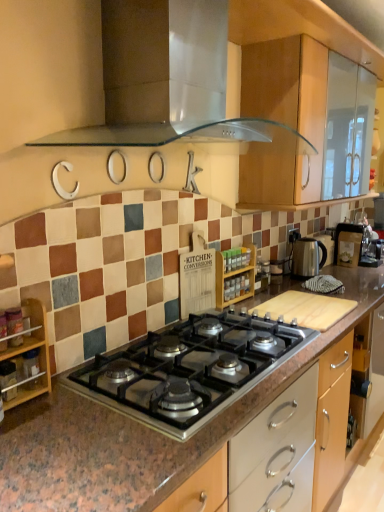
This screenshot has width=384, height=512. What do you see at coordinates (326, 245) in the screenshot?
I see `metallic silver kettle at right, the 1th appliance positioned from the back` at bounding box center [326, 245].

At what (x,y) coordinates should I click in order to perform the action: click on silver metallic kettle at right. Please return your answer as a coordinate pair (x, y). The image size is (384, 512). Looking at the image, I should click on (307, 257).

I want to click on wooden shelf at left, so click(29, 358).

Can you confirm if silver metallic kettle at right is taller than metallic silver coffee maker at right, which is counted as the 1th appliance, starting from the right?

No.

Are silver metallic kettle at right and metallic silver coffee maker at right, acting as the third appliance starting from the left, beside each other?

No, silver metallic kettle at right is not beside metallic silver coffee maker at right, acting as the third appliance starting from the left.

Locate an element on the screen. kitchen appliance below the metallic silver coffee maker at right, marked as the second appliance in a front-to-back arrangement (from the image's perspective) is located at coordinates (307, 257).

Does point (309, 274) come in front of point (360, 254)?

Yes, it is in front of point (360, 254).

Does transparent glass range hood at upper center have a larger size compared to metallic silver coffee maker at right, the 2th appliance when ordered from back to front?

Correct, transparent glass range hood at upper center is larger in size than metallic silver coffee maker at right, the 2th appliance when ordered from back to front.

From a real-world perspective, is transparent glass range hood at upper center beneath metallic silver coffee maker at right, acting as the third appliance starting from the left?

No, from a real-world perspective, transparent glass range hood at upper center is not beneath metallic silver coffee maker at right, acting as the third appliance starting from the left.

Is point (159, 58) closer or farther from the camera than point (349, 244)?

Point (159, 58) is positioned closer to the camera compared to point (349, 244).

From a real-world perspective, which appliance is the 1st one underneath the transparent glass range hood at upper center? Please provide its 2D coordinates.

[(348, 244)]

Between metallic silver coffee maker at right, marked as the second appliance in a front-to-back arrangement, and black stainless steel gas stove at center, which one has larger width?

With larger width is black stainless steel gas stove at center.

Consider the image. Which is correct: metallic silver coffee maker at right, acting as the third appliance starting from the left, is inside black stainless steel gas stove at center, or outside of it?

metallic silver coffee maker at right, acting as the third appliance starting from the left, is not enclosed by black stainless steel gas stove at center.

Can you tell me how much metallic silver coffee maker at right, which is counted as the 1th appliance, starting from the right, and black stainless steel gas stove at center differ in facing direction?

The angular difference between metallic silver coffee maker at right, which is counted as the 1th appliance, starting from the right, and black stainless steel gas stove at center is 0.57 degrees.

Between metallic silver coffee maker at right, which is counted as the 1th appliance, starting from the right, and black stainless steel gas stove at center, which one has smaller size?

metallic silver coffee maker at right, which is counted as the 1th appliance, starting from the right, is smaller.

Does metallic silver coffee maker at right, acting as the third appliance starting from the left, have a lesser width compared to wooden shelf at left?

No, metallic silver coffee maker at right, acting as the third appliance starting from the left, is not thinner than wooden shelf at left.

Does metallic silver coffee maker at right, acting as the third appliance starting from the left, have a smaller size compared to wooden shelf at left?

Incorrect, metallic silver coffee maker at right, acting as the third appliance starting from the left, is not smaller in size than wooden shelf at left.

From the image's perspective, which object appears higher, metallic silver coffee maker at right, which is counted as the 1th appliance, starting from the right, or wooden shelf at left?

From the image's view, metallic silver coffee maker at right, which is counted as the 1th appliance, starting from the right, is above.

Does point (354, 248) lie behind point (13, 366)?

Yes, it is.

From the image's perspective, between metallic silver coffee maker at right, which is counted as the 1th appliance, starting from the right, and silver metallic kettle at right, which one is located above?

metallic silver coffee maker at right, which is counted as the 1th appliance, starting from the right, is shown above in the image.

In the scene shown: Looking at their sizes, would you say metallic silver coffee maker at right, acting as the third appliance starting from the left, is wider or thinner than silver metallic kettle at right?

Clearly, metallic silver coffee maker at right, acting as the third appliance starting from the left, has more width compared to silver metallic kettle at right.

Is metallic silver coffee maker at right, acting as the third appliance starting from the left, touching silver metallic kettle at right?

No, metallic silver coffee maker at right, acting as the third appliance starting from the left, is not in contact with silver metallic kettle at right.

Are black stainless steel gas stove at center and silver metallic kettle at right making contact?

No, black stainless steel gas stove at center is not beside silver metallic kettle at right.

Can we say black stainless steel gas stove at center lies outside silver metallic kettle at right?

Yes, black stainless steel gas stove at center is located beyond the bounds of silver metallic kettle at right.

Does black stainless steel gas stove at center lie in front of silver metallic kettle at right?

Yes, the depth of black stainless steel gas stove at center is less than that of silver metallic kettle at right.

Which is further, (140, 347) or (313, 273)?

The point (313, 273) is farther from the camera.

Which object is wider, wooden shelf at left or transparent glass range hood at upper center?

Wider between the two is transparent glass range hood at upper center.

Can you confirm if wooden shelf at left is bigger than transparent glass range hood at upper center?

Actually, wooden shelf at left might be smaller than transparent glass range hood at upper center.

Is wooden shelf at left facing away from transparent glass range hood at upper center?

wooden shelf at left does not have its back to transparent glass range hood at upper center.

Would you consider wooden shelf at left to be distant from transparent glass range hood at upper center?

No, wooden shelf at left is in close proximity to transparent glass range hood at upper center.

What are the coordinates of `the 1st appliance behind the silver metallic kettle at right` in the screenshot? It's located at (348, 244).

Where is `the 1st appliance below when counting from the transparent glass range hood at upper center (from the image's perspective)`? Image resolution: width=384 pixels, height=512 pixels. the 1st appliance below when counting from the transparent glass range hood at upper center (from the image's perspective) is located at coordinates (348, 244).

Which object lies further to the anchor point metallic silver kettle at right, the 1th appliance positioned from the back, metallic silver coffee maker at right, the 2th appliance when ordered from back to front, or silver metallic kettle at right?

Among the two, metallic silver coffee maker at right, the 2th appliance when ordered from back to front, is located further to metallic silver kettle at right, the 1th appliance positioned from the back.

From the image, which object appears to be nearer to transparent glass range hood at upper center, metallic silver coffee maker at right, the 2th appliance when ordered from back to front, or black stainless steel gas stove at center?

black stainless steel gas stove at center lies closer to transparent glass range hood at upper center than the other object.

Estimate the real-world distances between objects in this image. Which object is further from wooden shelf at left, transparent glass range hood at upper center or silver metallic kettle at right?

Based on the image, silver metallic kettle at right appears to be further to wooden shelf at left.

Based on their spatial positions, is metallic silver kettle at right, the 1th appliance positioned from the back, or wooden spice rack at center, the 3th appliance when ordered from back to front, closer to silver metallic kettle at right?

The object closer to silver metallic kettle at right is metallic silver kettle at right, the 1th appliance positioned from the back.

Consider the image. Considering their positions, is metallic silver kettle at right, marked as the third appliance in a front-to-back arrangement, positioned further to metallic silver coffee maker at right, the 2th appliance when ordered from back to front, than black stainless steel gas stove at center?

Based on the image, black stainless steel gas stove at center appears to be further to metallic silver coffee maker at right, the 2th appliance when ordered from back to front.

When comparing their distances from metallic silver kettle at right, the 2th appliance viewed from the left, does wooden shelf at left or metallic silver coffee maker at right, acting as the third appliance starting from the left, seem closer?

Among the two, metallic silver coffee maker at right, acting as the third appliance starting from the left, is located nearer to metallic silver kettle at right, the 2th appliance viewed from the left.

Looking at the image, which one is located closer to metallic silver kettle at right, which ranks as the second appliance in right-to-left order, black stainless steel gas stove at center or wooden shelf at left?

black stainless steel gas stove at center lies closer to metallic silver kettle at right, which ranks as the second appliance in right-to-left order, than the other object.

Considering their positions, is metallic silver kettle at right, marked as the third appliance in a front-to-back arrangement, positioned further to wooden spice rack at center, positioned as the 3th appliance in right-to-left order, than metallic silver coffee maker at right, marked as the second appliance in a front-to-back arrangement?

Among the two, metallic silver coffee maker at right, marked as the second appliance in a front-to-back arrangement, is located further to wooden spice rack at center, positioned as the 3th appliance in right-to-left order.

Where is `appliance positioned between transparent glass range hood at upper center and silver metallic kettle at right from near to far`? appliance positioned between transparent glass range hood at upper center and silver metallic kettle at right from near to far is located at coordinates (234, 278).

Image resolution: width=384 pixels, height=512 pixels. Identify the location of shelf between black stainless steel gas stove at center and metallic silver coffee maker at right, acting as the third appliance starting from the left, from front to back. (29, 358).

The image size is (384, 512). I want to click on shelf between transparent glass range hood at upper center and black stainless steel gas stove at center vertically, so click(x=29, y=358).

Where is `appliance located between black stainless steel gas stove at center and silver metallic kettle at right in the depth direction`? appliance located between black stainless steel gas stove at center and silver metallic kettle at right in the depth direction is located at coordinates (234, 278).